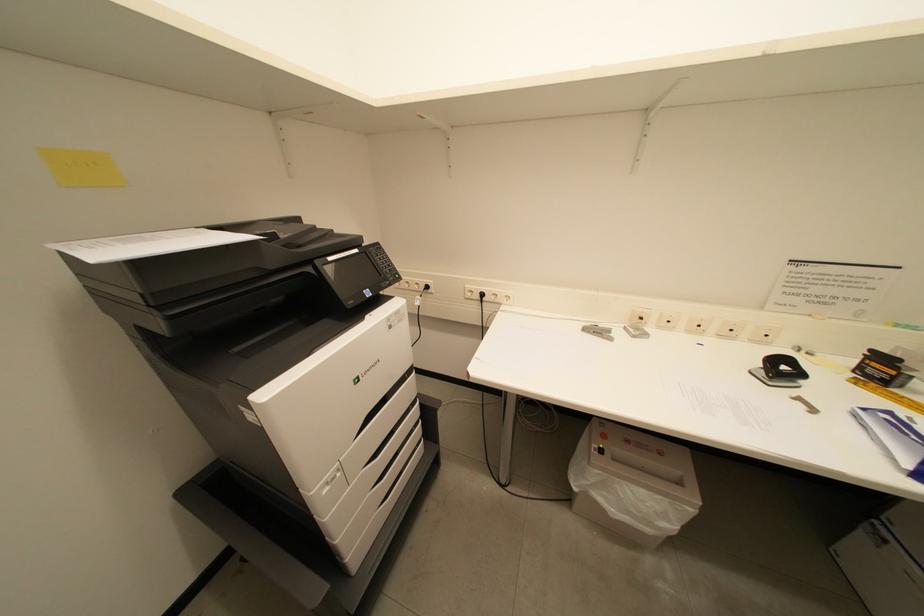
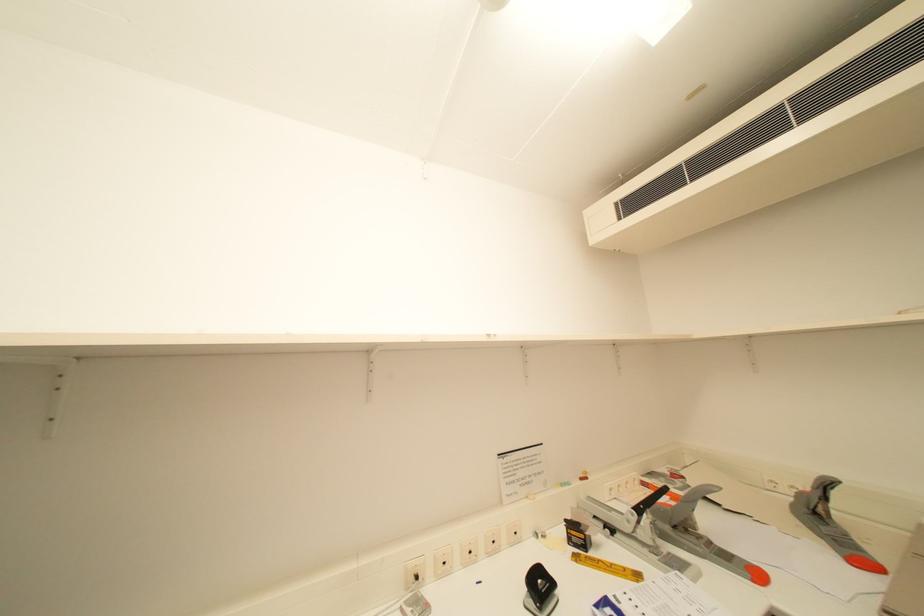
The images are taken continuously from a first-person perspective. In which direction is your viewpoint rotating?

The camera rotated toward right-up.